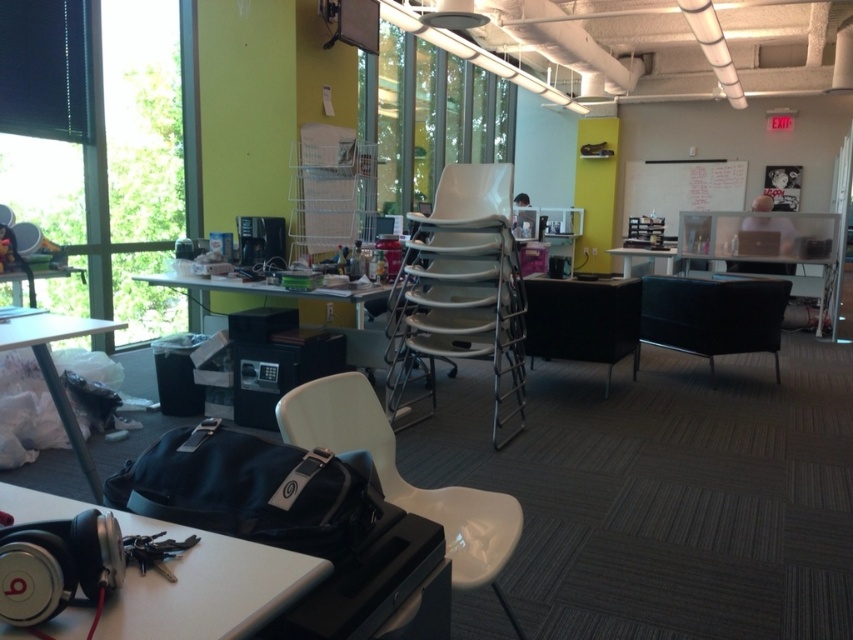
Question: Observing the image, what is the correct spatial positioning of white plastic table at lower left in reference to transparent glass window at upper center?

Choices:
 (A) right
 (B) left

Answer: (B)

Question: Which object appears closest to the camera in this image?

Choices:
 (A) metallic silver table at center
 (B) white plastic swivel chair at center
 (C) matte black bag at lower left
 (D) transparent glass window at upper center

Answer: (B)

Question: Among these objects, which one is nearest to the camera?

Choices:
 (A) white plastic swivel chair at center
 (B) transparent glass window at upper left
 (C) black leather swivel chair at center
 (D) white plastic table at lower left

Answer: (D)

Question: Which of the following is the farthest from the observer?

Choices:
 (A) transparent glass window at upper left
 (B) white plastic table at lower left

Answer: (A)

Question: Can you confirm if white plastic chair at center is thinner than white plastic swivel chair at center?

Choices:
 (A) no
 (B) yes

Answer: (A)

Question: Is white plastic table at lower left closer to the viewer compared to white plastic swivel chair at center?

Choices:
 (A) no
 (B) yes

Answer: (B)